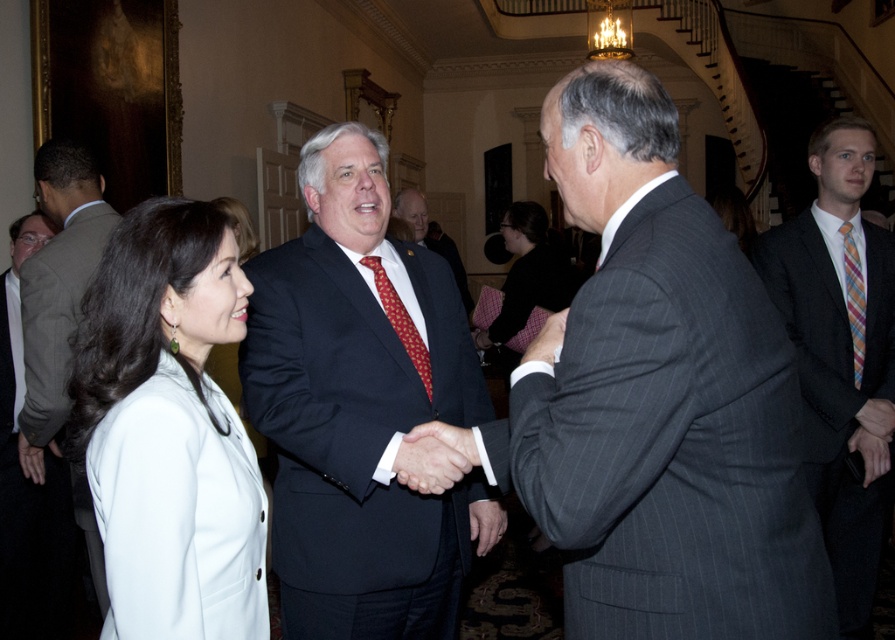
Is white fabric coat at left to the right of dark suit at center from the viewer's perspective?

In fact, white fabric coat at left is to the left of dark suit at center.

Who is lower down, white fabric coat at left or dark suit at center?

white fabric coat at left

Who is more distant from viewer, (111, 609) or (397, 211)?

Point (397, 211)

The width and height of the screenshot is (895, 640). Identify the location of white fabric coat at left. (x=169, y=428).

Can you confirm if red silk tie at center is bigger than plaid silk tie at right?

Correct, red silk tie at center is larger in size than plaid silk tie at right.

How distant is red silk tie at center from plaid silk tie at right?

They are 7.37 feet apart.

This screenshot has width=895, height=640. I want to click on red silk tie at center, so click(399, 321).

Measure the distance between point (x=91, y=573) and camera.

Point (x=91, y=573) is 11.30 feet away from camera.

Does light brown suit at left come in front of plaid silk tie at right?

Yes, light brown suit at left is closer to the viewer.

The height and width of the screenshot is (640, 895). What do you see at coordinates (57, 289) in the screenshot?
I see `light brown suit at left` at bounding box center [57, 289].

At what (x,y) coordinates should I click in order to perform the action: click on light brown suit at left. Please return your answer as a coordinate pair (x, y). Image resolution: width=895 pixels, height=640 pixels. Looking at the image, I should click on (57, 289).